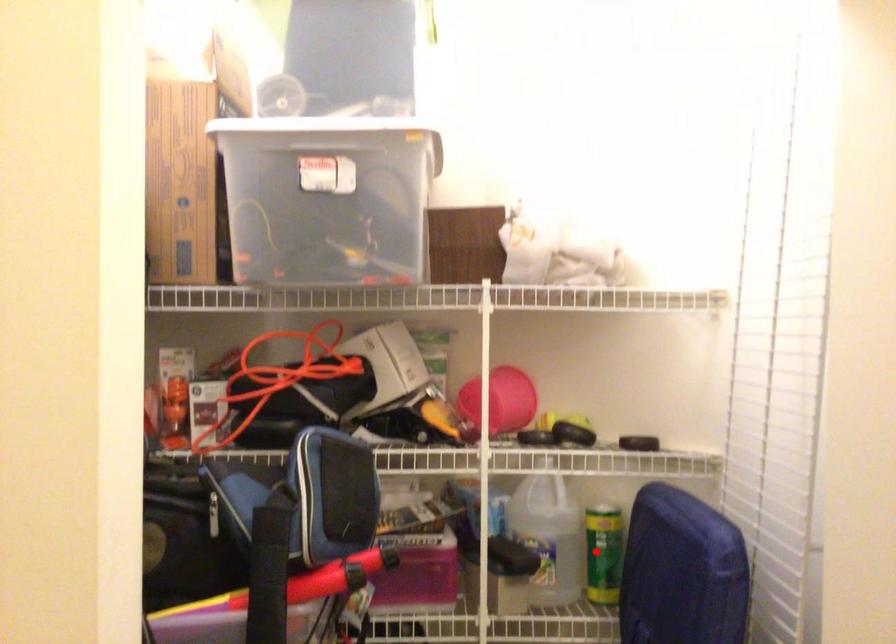
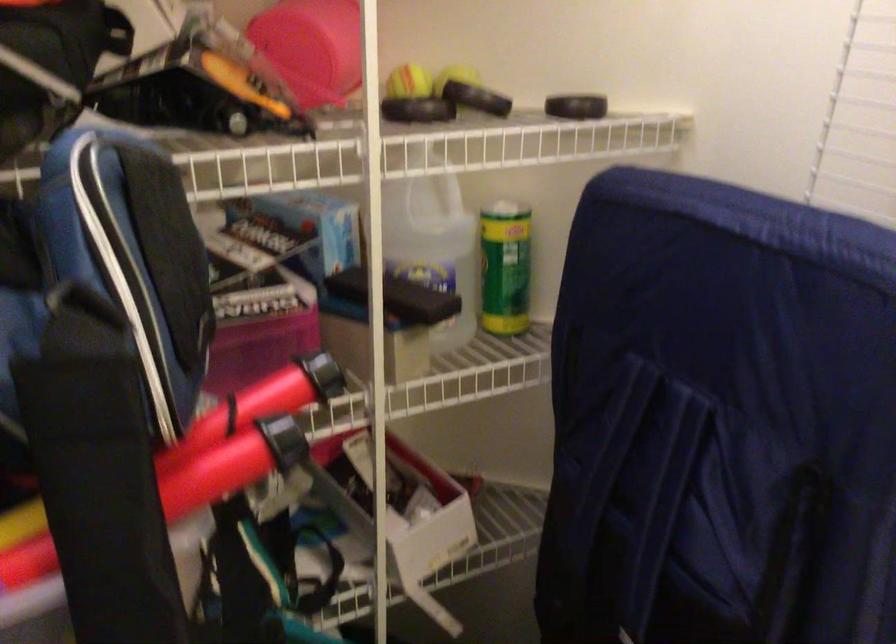
Find the pixel in the second image that matches the highlighted location in the first image.

(504, 267)